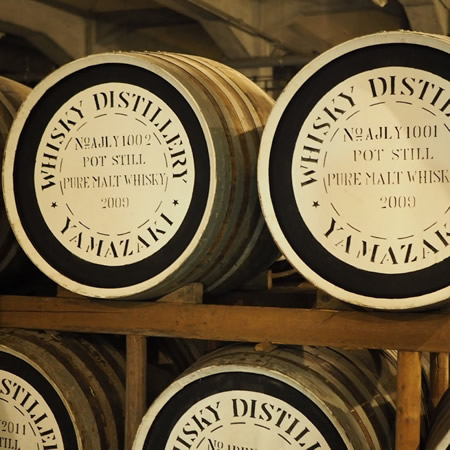
Locate an element on the screen. The image size is (450, 450). vertical beam is located at coordinates (126, 373).